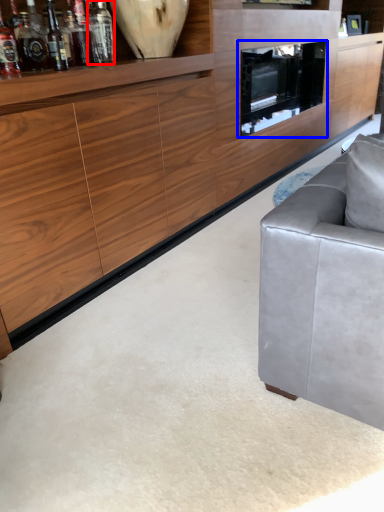
Question: Which point is further to the camera, bottle (highlighted by a red box) or tv cabinet (highlighted by a blue box)?

Choices:
 (A) bottle
 (B) tv cabinet

Answer: (B)